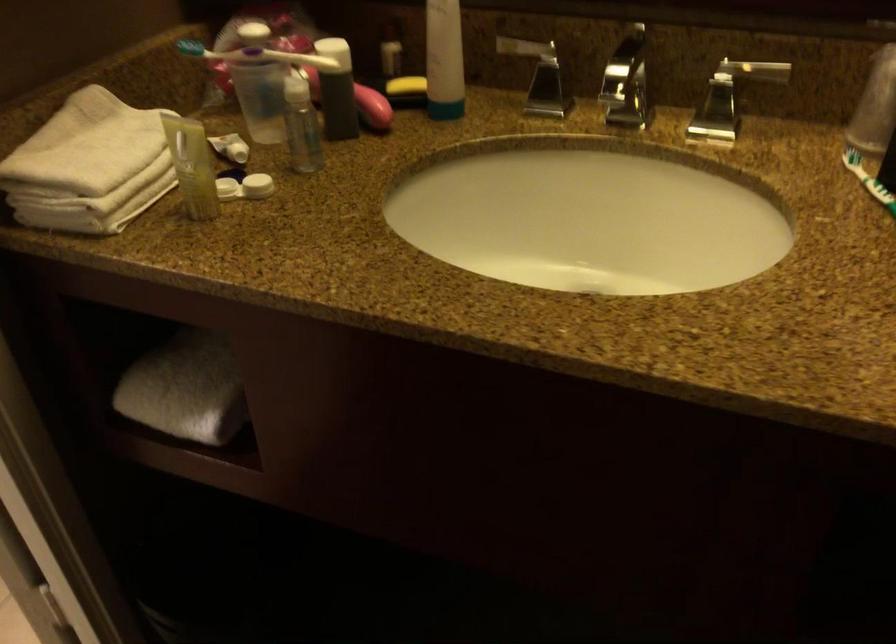
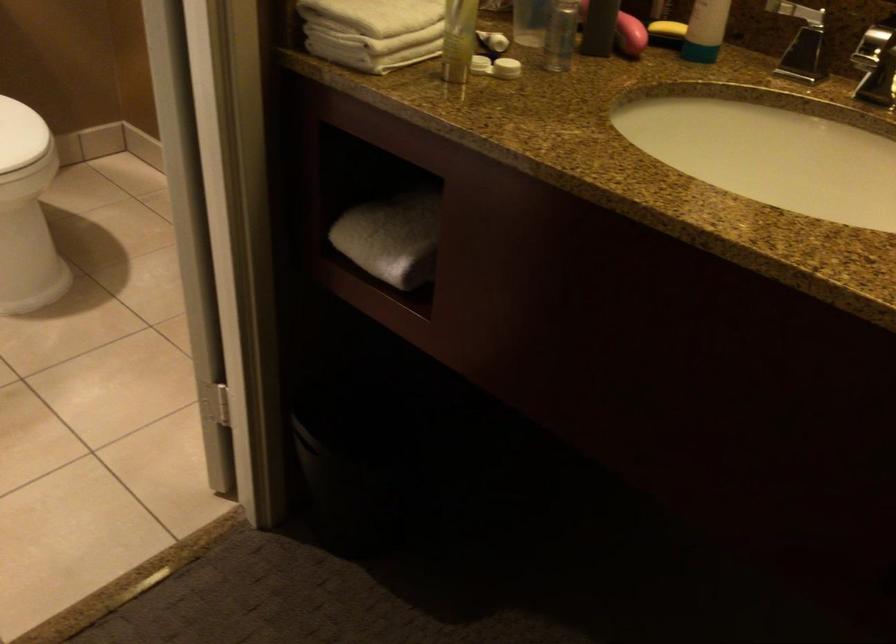
In the second image, find the point that corresponds to point (91, 213) in the first image.

(366, 51)